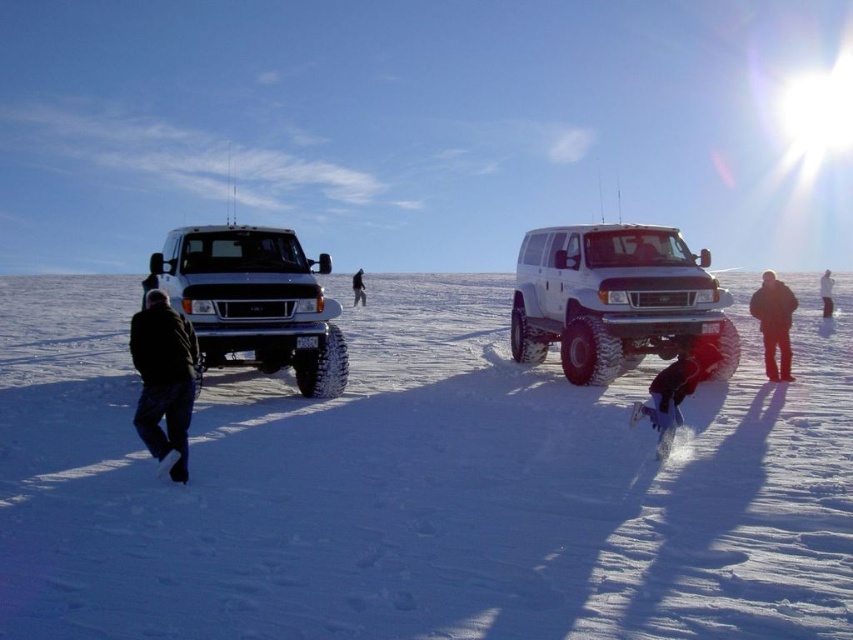
Between point (68, 480) and point (785, 326), which one is positioned behind?

The point (785, 326) is more distant.

Which is above, white powdery snow at center or black woolen jacket at right?

white powdery snow at center

Identify the location of white powdery snow at center. (419, 486).

Does white powdery snow at center have a greater height compared to red snowboard at lower right?

Indeed, white powdery snow at center has a greater height compared to red snowboard at lower right.

Between point (103, 513) and point (694, 378), which one is positioned behind?

Point (694, 378)

The width and height of the screenshot is (853, 640). Find the location of `white powdery snow at center`. white powdery snow at center is located at coordinates (419, 486).

Find the location of a particular element. white powdery snow at center is located at coordinates (419, 486).

Does point (358, 625) come in front of point (824, 276)?

Yes.

Describe the element at coordinates (419, 486) in the screenshot. I see `white powdery snow at center` at that location.

Between point (585, 412) and point (828, 316), which one is positioned in front?

Point (585, 412) is in front.

I want to click on white powdery snow at center, so [x=419, y=486].